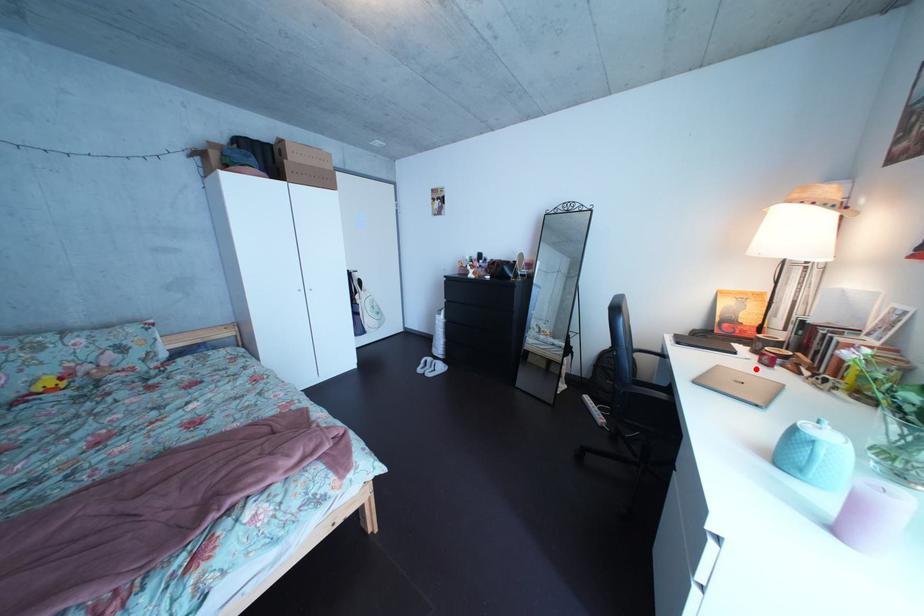
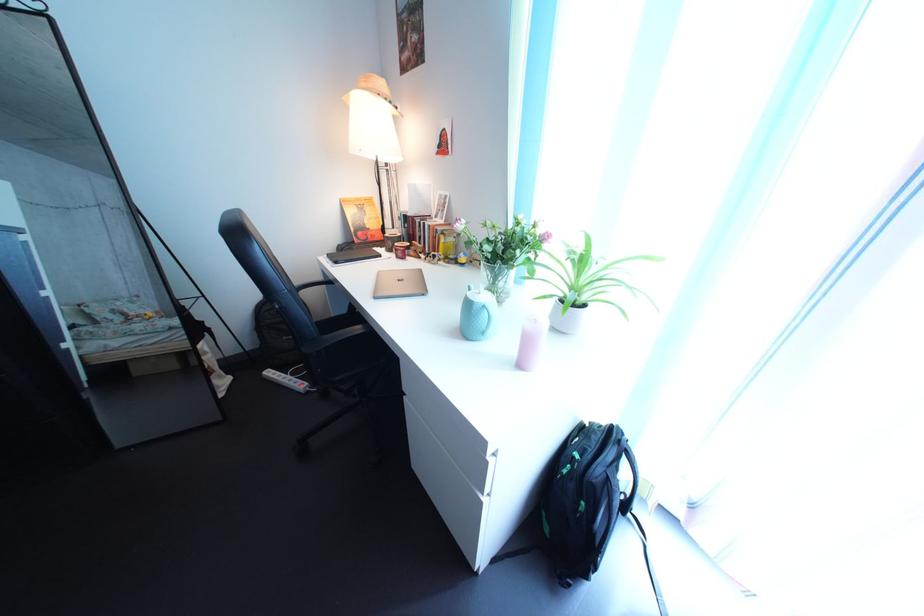
Locate, in the second image, the point that corresponds to the highlighted location in the first image.

(402, 269)